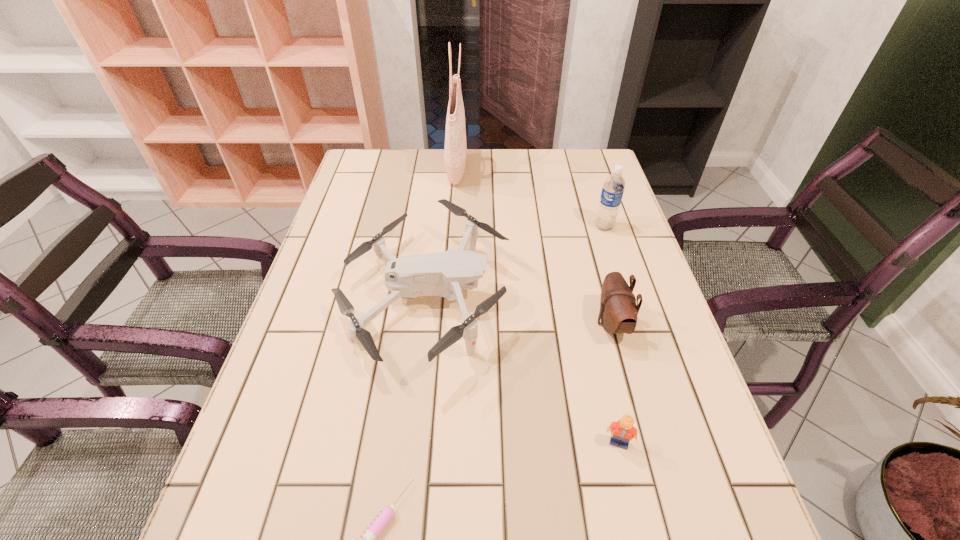
You are a GUI agent. You are given a task and a screenshot of the screen. Output one action in this format:
    pyautogui.click(x=<x>, y=<y>)
    Task: Click on the vacant region at the far edge
    
    Given the screenshot: What is the action you would take?
    pyautogui.click(x=420, y=156)

Locate an element on the screen. This screenshot has height=540, width=960. vacant space at the left edge of the desktop is located at coordinates (387, 214).

In the image, there is a desktop. In order to click on vacant space at the right edge in this screenshot , I will do `click(622, 236)`.

The width and height of the screenshot is (960, 540). Find the location of `free region at the far right corner`. free region at the far right corner is located at coordinates (565, 149).

I want to click on vacant space in between the drone and the fifth tallest object, so click(x=522, y=371).

I want to click on free area in between the farthest object and the fifth shortest object, so click(x=530, y=199).

Identify the location of free space between the tallest object and the second farthest object. This screenshot has width=960, height=540. [530, 199].

This screenshot has height=540, width=960. In order to click on object identified as the closest to the second nearest object in this screenshot , I will do `click(444, 274)`.

Locate which object ranks third in proximity to the tallest object. Please provide its 2D coordinates. Your answer should be formatted as a tuple, i.e. [(x, y)], where the tuple contains the x and y coordinates of a point satisfying the conditions above.

[(618, 312)]